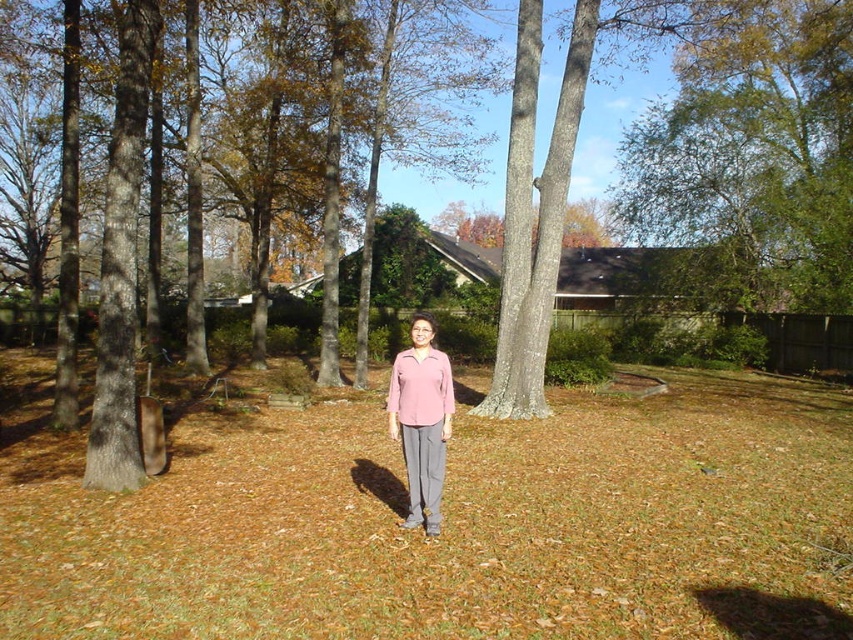
You are a photographer trying to capture a photo of the brown grass at center and the pink matte shirt at center. Based on their heights, which one should you focus on first if you want to ensure both are in focus without adjusting the camera settings?

The brown grass at center is not as tall as the pink matte shirt at center, so you should focus on the pink matte shirt at center first since it is taller and will be in focus if the grass is also in focus.

You are a photographer trying to capture the scene with the brown grass at center and the pink matte sweater at center. Which object is closer to the camera lens?

The pink matte sweater at center is closer to the camera lens because it is positioned over the brown grass at center, which is underneath it.